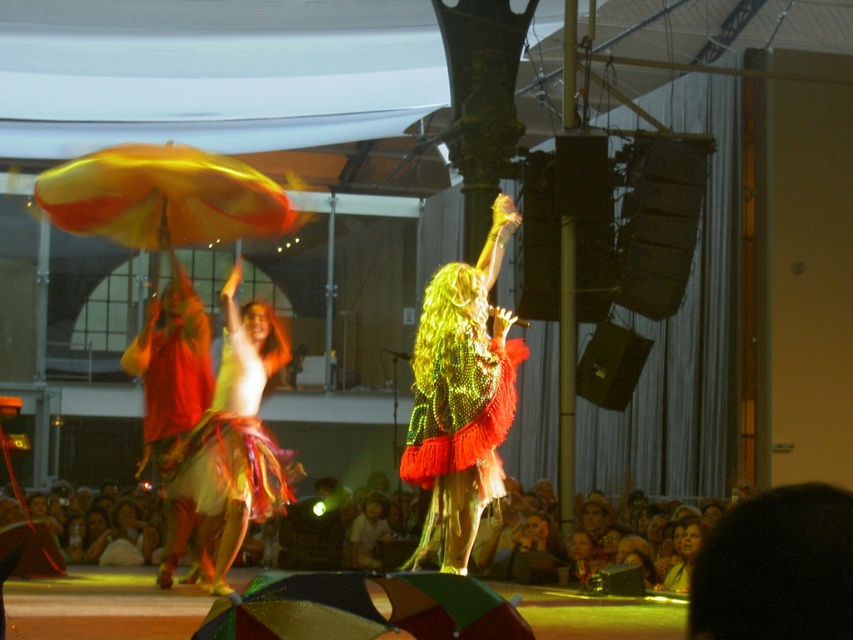
You are a photographer standing behind the stage. You want to take a photo that includes both the green sequined dress at center and the shiny metallic skirt at center. If your camera can capture a maximum distance of 7 feet between the closest and farthest objects, will you be able to include both in the photo?

The distance between the green sequined dress at center and the shiny metallic skirt at center is 7.38 feet, which exceeds the camera maximum capture distance of 7 feet. Therefore, you cannot include both in the photo.

You are standing at the camera position and want to take a photo of the point at coordinates point [100,524]. The camera has a maximum focus range of 60 feet. Will the point be in focus?

The point at coordinates point [100,524] is 62.98 feet away from the camera, which exceeds the maximum focus range of 60 feet. Therefore, the point will not be in focus.